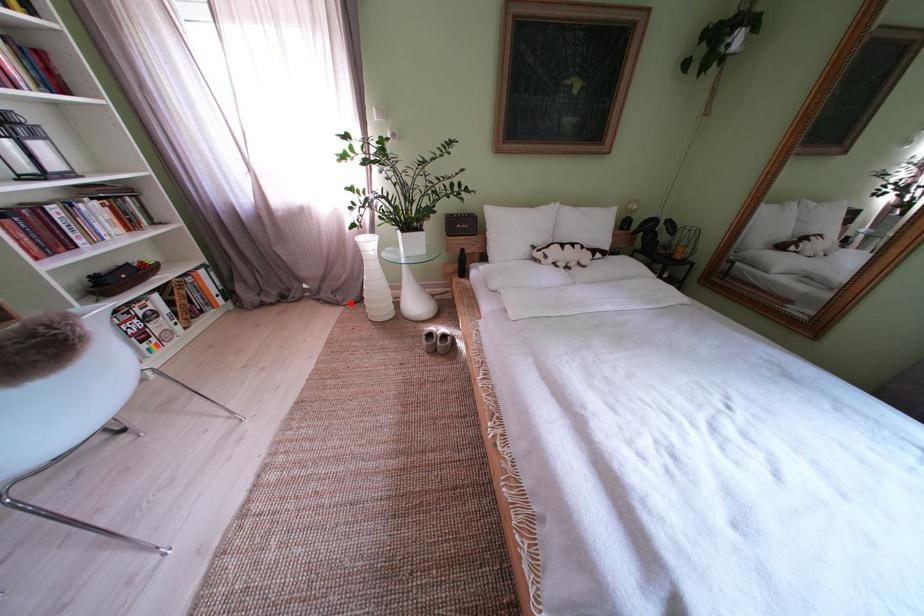
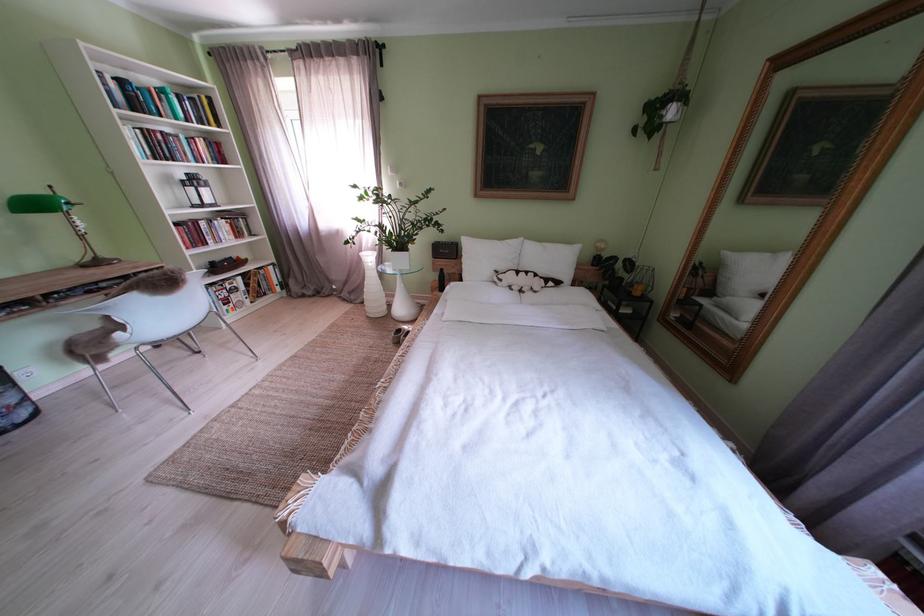
The point at the highlighted location is marked in the first image. Where is the corresponding point in the second image?

(363, 302)